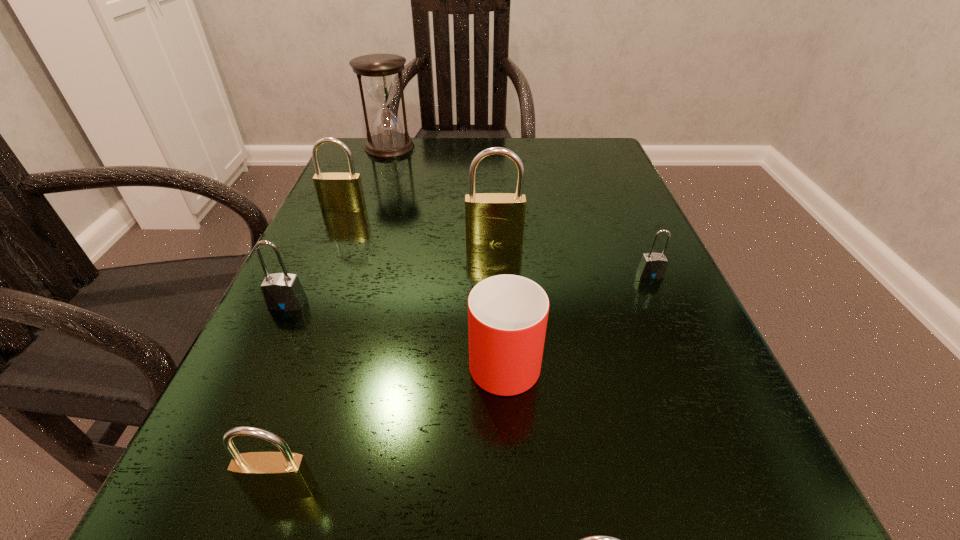
Identify the location of the third farthest brass padlock. (283, 475).

At what (x,y) coordinates should I click in order to perform the action: click on the farther gray padlock. Please return your answer as a coordinate pair (x, y). Looking at the image, I should click on (652, 265).

I want to click on the rightmost object, so click(652, 265).

Locate an element on the screen. free space located on the front of the hourglass is located at coordinates (374, 190).

This screenshot has height=540, width=960. Find the location of `free spot located 0.280m on the front-facing side of the third farthest object`. free spot located 0.280m on the front-facing side of the third farthest object is located at coordinates (500, 371).

Find the location of `vacant space located 0.290m on the front-facing side of the third tallest object`. vacant space located 0.290m on the front-facing side of the third tallest object is located at coordinates (297, 318).

The image size is (960, 540). Identify the location of free spot located 0.260m on the side of the red cup with the handle. (497, 222).

The width and height of the screenshot is (960, 540). I want to click on vacant area situated on the side of the red cup with the handle, so click(x=499, y=268).

Where is `free space located on the side of the red cup with the handle`? The height and width of the screenshot is (540, 960). free space located on the side of the red cup with the handle is located at coordinates (499, 268).

Where is `free location located 0.060m on the shackle of the fifth farthest object`? free location located 0.060m on the shackle of the fifth farthest object is located at coordinates (270, 341).